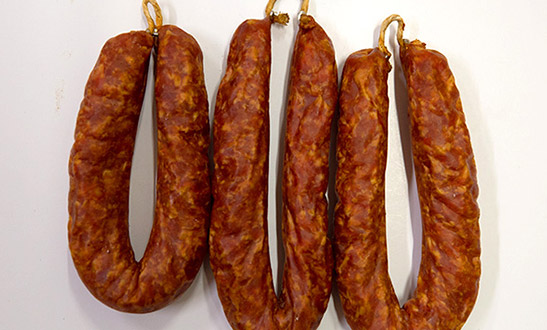
The image size is (547, 330). Identify the location of white table. (352, 20).